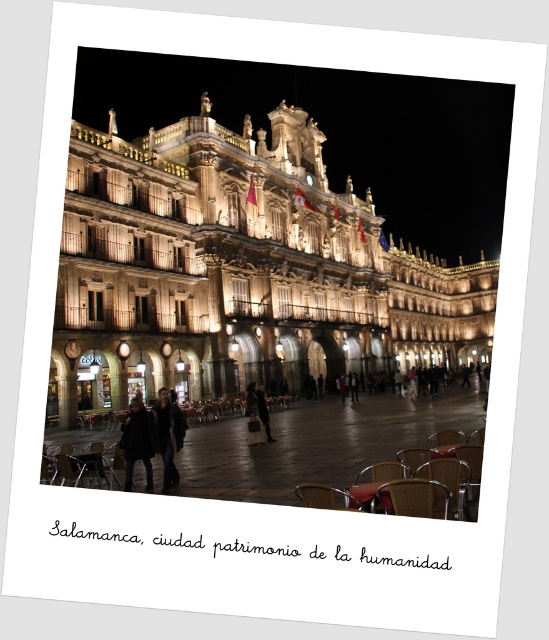
Question: Where is illuminated stone palace at center located in relation to woven wood chair at lower center in the image?

Choices:
 (A) left
 (B) right

Answer: (A)

Question: In this image, where is illuminated stone palace at center located relative to woven wood chair at lower center?

Choices:
 (A) above
 (B) below

Answer: (A)

Question: Among these objects, which one is nearest to the camera?

Choices:
 (A) dark gray coat at center
 (B) illuminated stone palace at center

Answer: (B)

Question: Which object is positioned closest to the wooden chair at lower right?

Choices:
 (A) dark wool coat at center
 (B) dark gray coat at center

Answer: (A)

Question: Considering the relative positions of brown woven chair at lower center and wooden chair at lower right in the image provided, where is brown woven chair at lower center located with respect to wooden chair at lower right?

Choices:
 (A) left
 (B) right

Answer: (A)

Question: Estimate the real-world distances between objects in this image. Which object is farther from the wooden chair at lower center?

Choices:
 (A) brown woven chair at lower center
 (B) dark gray coat at center
 (C) dark fabric coat at center

Answer: (B)